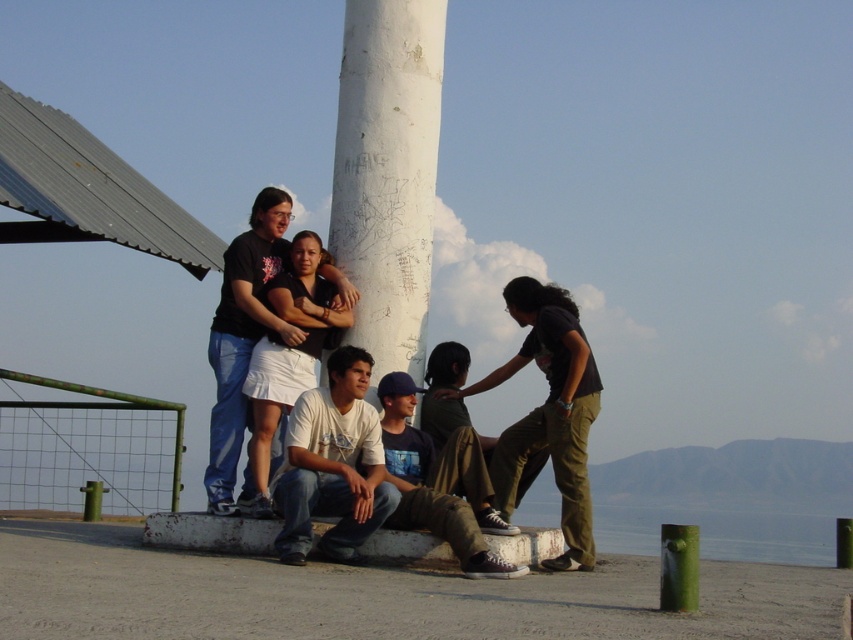
You are planning to take a photo of the white matte pillar at center and the white cotton shirt at center. Which object should you focus on first if you want to capture both in a single frame without moving the camera?

You should focus on the white cotton shirt at center first because it occupies more space than the white matte pillar at center, ensuring it fits well within the frame.

Based on the photo, you are a photographer trying to capture a photo of the white matte pillar at center and the white cotton shirt at center. If you want to ensure both objects are fully visible in the frame, which one should you focus on first to avoid cropping?

Since the white matte pillar at center is narrower than the white cotton shirt at center, you should focus on the wider white cotton shirt at center first to ensure it fits entirely within the frame.

You are standing at the center of the image and want to take a photo of the white matte pillar at center. In which direction should you move to ensure the pillar is in the center of your camera frame?

Since the white matte pillar at center is already located at the center of the image, you don not need to move. Simply aim your camera at the white matte pillar at center to have it centered in your frame.